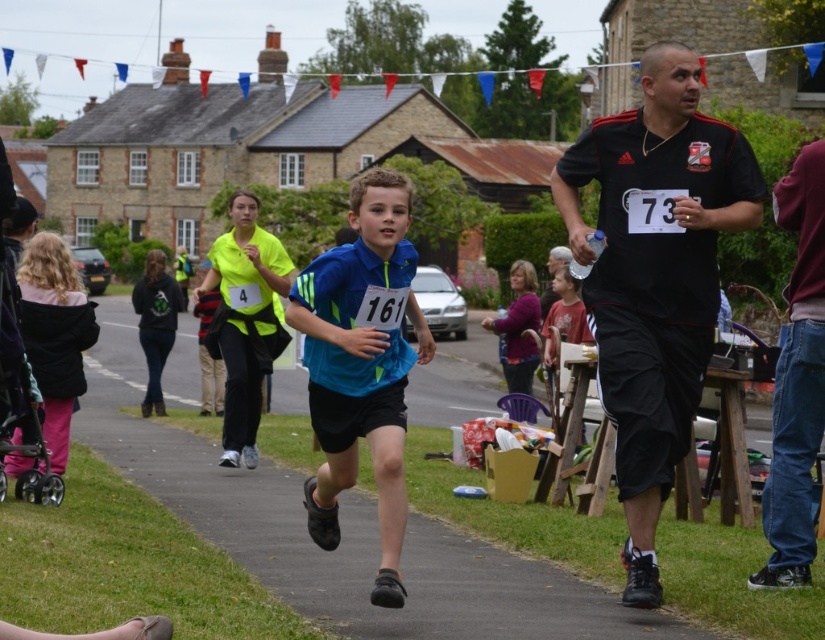
Question: Can you confirm if dark blue jeans at right is positioned above black fleece jacket at left?

Choices:
 (A) yes
 (B) no

Answer: (B)

Question: Does blue fabric shorts at center come behind purple fleece jacket at center?

Choices:
 (A) no
 (B) yes

Answer: (A)

Question: Does dark blue jeans at right appear on the left side of purple fleece jacket at center?

Choices:
 (A) yes
 (B) no

Answer: (B)

Question: Which of these objects is positioned farthest from the purple fleece jacket at center?

Choices:
 (A) blue fabric shirt at center
 (B) black matte shirt at right
 (C) dark blue jeans at right
 (D) black fleece jacket at left

Answer: (B)

Question: Which point is farther to the camera?

Choices:
 (A) (45, 300)
 (B) (446, 532)
 (C) (168, 333)

Answer: (C)

Question: Which object is closer to the camera taking this photo?

Choices:
 (A) blue fabric shorts at center
 (B) dark blue jeans at right
 (C) dark gray hoodie at left
 (D) black matte shirt at right

Answer: (A)